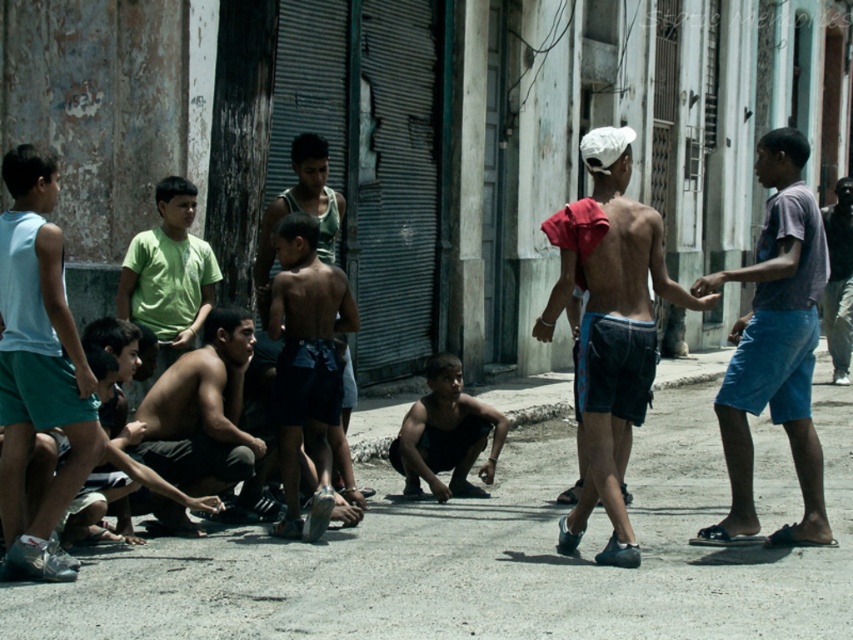
Consider the image. You are a street vendor who wants to place a new stand between the shiny blue shorts at center and the shiny black shorts at center. Which side of the path between them should you choose to ensure your stand fits without overlapping either pair of shorts?

The shiny blue shorts at center might be wider than the shiny black shorts at center, so placing the stand on the side closer to the shiny black shorts at center would provide more space to avoid overlapping.